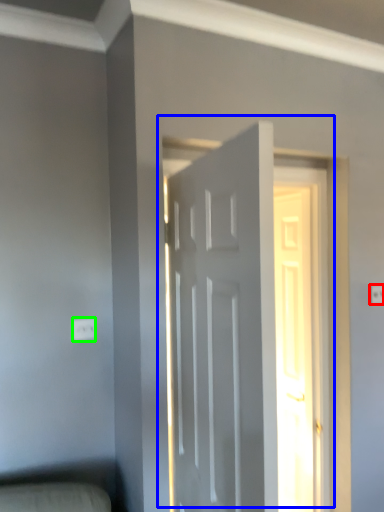
Question: Which object is the closest to the electric outlet (highlighted by a red box)? Choose among these: door (highlighted by a blue box) or electric outlet (highlighted by a green box).

Choices:
 (A) door
 (B) electric outlet

Answer: (A)